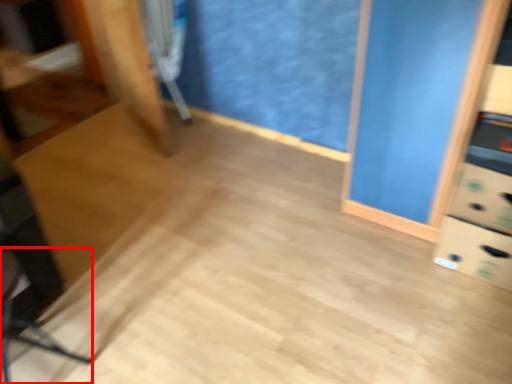
Question: From the image's perspective, where is swivel chair (annotated by the red box) located in relation to swivel chair in the image?

Choices:
 (A) below
 (B) above

Answer: (A)